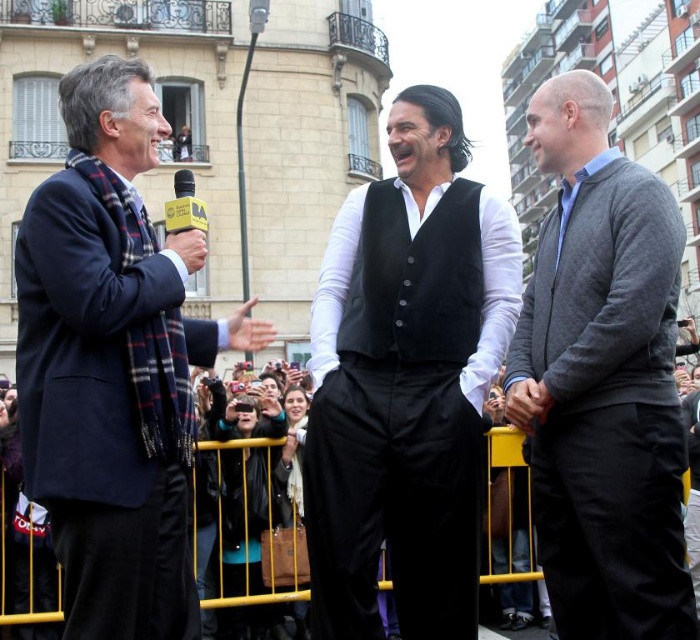
Does matte black coat at left have a greater width compared to black matte vest at center?

Indeed, matte black coat at left has a greater width compared to black matte vest at center.

Does matte black coat at left have a larger size compared to black matte vest at center?

Indeed, matte black coat at left has a larger size compared to black matte vest at center.

Which is behind, point (106, 467) or point (374, 339)?

The point (374, 339) is behind.

Image resolution: width=700 pixels, height=640 pixels. What are the coordinates of `matte black coat at left` in the screenshot? It's located at coord(113,364).

Is gray wool sweater at right to the left of black matte vest at center from the viewer's perspective?

No, gray wool sweater at right is not to the left of black matte vest at center.

Is gray wool sweater at right taller than black matte vest at center?

Yes, gray wool sweater at right is taller than black matte vest at center.

This screenshot has height=640, width=700. Describe the element at coordinates (602, 380) in the screenshot. I see `gray wool sweater at right` at that location.

Where is `gray wool sweater at right`? The height and width of the screenshot is (640, 700). gray wool sweater at right is located at coordinates 602,380.

Is matte black coat at left smaller than gray wool sweater at right?

Actually, matte black coat at left might be larger than gray wool sweater at right.

Describe the element at coordinates (113, 364) in the screenshot. I see `matte black coat at left` at that location.

Locate an element on the screen. matte black coat at left is located at coordinates (113, 364).